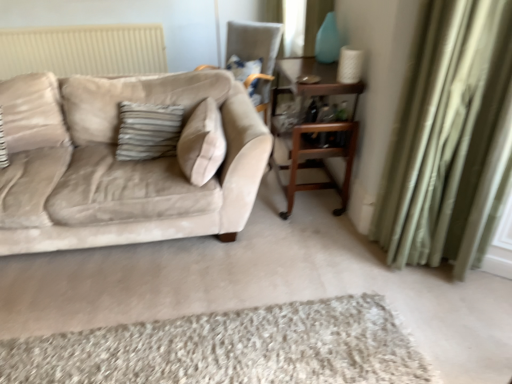
What do you see at coordinates (256, 53) in the screenshot? I see `velvet beige chair at upper center` at bounding box center [256, 53].

What is the approximate width of velvet beige chair at upper center?

The width of velvet beige chair at upper center is 34.68 inches.

In order to click on beige velvet couch at left in this screenshot , I will do `click(125, 162)`.

I want to click on shaggy beige rug at lower center, so click(230, 348).

Measure the distance between velvet beige chair at upper center and shaggy beige rug at lower center.

velvet beige chair at upper center is 8.39 feet from shaggy beige rug at lower center.

From the image's perspective, which one is positioned higher, velvet beige chair at upper center or shaggy beige rug at lower center?

velvet beige chair at upper center appears higher in the image.

In terms of width, does velvet beige chair at upper center look wider or thinner when compared to shaggy beige rug at lower center?

In the image, velvet beige chair at upper center appears to be wider than shaggy beige rug at lower center.

Considering their positions, is velvet beige chair at upper center located in front of or behind shaggy beige rug at lower center?

Clearly, velvet beige chair at upper center is behind shaggy beige rug at lower center.

From the image's perspective, is green velvet curtain at right under wooden table at center?

Yes, from the image's perspective, green velvet curtain at right is beneath wooden table at center.

The height and width of the screenshot is (384, 512). I want to click on table below the green velvet curtain at right (from a real-world perspective), so click(x=313, y=128).

Is point (428, 77) less distant than point (281, 88)?

Yes.

From a real-world perspective, is green velvet curtain at right physically located above or below wooden table at center?

Clearly, from a real-world perspective, green velvet curtain at right is above wooden table at center.

How many degrees apart are the facing directions of green velvet curtain at right and shaggy beige rug at lower center?

144 degrees.

Would you say green velvet curtain at right is outside shaggy beige rug at lower center?

Yes, green velvet curtain at right is located beyond the bounds of shaggy beige rug at lower center.

Which object is closer to the camera taking this photo, green velvet curtain at right or shaggy beige rug at lower center?

Positioned in front is green velvet curtain at right.

From their relative heights in the image, would you say green velvet curtain at right is taller or shorter than velvet beige chair at upper center?

green velvet curtain at right is taller than velvet beige chair at upper center.

Is green velvet curtain at right positioned in front of velvet beige chair at upper center?

Yes, it is in front of velvet beige chair at upper center.

Is velvet beige chair at upper center a part of green velvet curtain at right?

No, velvet beige chair at upper center is not surrounded by green velvet curtain at right.

Can you confirm if green velvet curtain at right is thinner than velvet beige chair at upper center?

Yes.

Considering the positions of point (232, 362) and point (187, 104), is point (232, 362) closer or farther from the camera than point (187, 104)?

Point (232, 362) is positioned closer to the camera compared to point (187, 104).

Locate an element on the screen. plain below the beige velvet couch at left (from a real-world perspective) is located at coordinates (230, 348).

Is the position of shaggy beige rug at lower center more distant than that of beige velvet couch at left?

No, shaggy beige rug at lower center is closer to the camera.

Is the surface of shaggy beige rug at lower center in direct contact with beige velvet couch at left?

shaggy beige rug at lower center and beige velvet couch at left are not in contact.

Is velvet beige chair at upper center facing towards beige velvet couch at left?

Yes.

Is velvet beige chair at upper center at the right side of beige velvet couch at left?

Yes.

From a real-world perspective, is velvet beige chair at upper center below beige velvet couch at left?

No.

How much distance is there between shaggy beige rug at lower center and wooden table at center?

shaggy beige rug at lower center and wooden table at center are 1.14 meters apart from each other.

Based on the photo, is shaggy beige rug at lower center positioned with its back to wooden table at center?

No, shaggy beige rug at lower center's orientation is not away from wooden table at center.

From the image's perspective, would you say shaggy beige rug at lower center is positioned over wooden table at center?

No, from the image's perspective, shaggy beige rug at lower center is not over wooden table at center.

Can you confirm if shaggy beige rug at lower center is wider than wooden table at center?

Yes.

In order to click on plain lying below the velvet beige chair at upper center (from the image's perspective) in this screenshot , I will do `click(230, 348)`.

This screenshot has width=512, height=384. I want to click on curtain that appears above the wooden table at center (from a real-world perspective), so click(452, 140).

When comparing their distances from shaggy beige rug at lower center, does green velvet curtain at right or velvet beige chair at upper center seem further?

velvet beige chair at upper center.

When comparing their distances from shaggy beige rug at lower center, does velvet beige chair at upper center or beige velvet couch at left seem closer?

beige velvet couch at left is closer to shaggy beige rug at lower center.

Estimate the real-world distances between objects in this image. Which object is closer to wooden table at center, beige velvet couch at left or green velvet curtain at right?

green velvet curtain at right is closer to wooden table at center.

Which object lies nearer to the anchor point shaggy beige rug at lower center, green velvet curtain at right or beige velvet couch at left?

green velvet curtain at right is closer to shaggy beige rug at lower center.

Estimate the real-world distances between objects in this image. Which object is closer to wooden table at center, beige velvet couch at left or shaggy beige rug at lower center?

beige velvet couch at left lies closer to wooden table at center than the other object.

Looking at the image, which one is located further to beige velvet couch at left, velvet beige chair at upper center or green velvet curtain at right?

velvet beige chair at upper center.

Looking at the image, which one is located closer to shaggy beige rug at lower center, beige velvet couch at left or velvet beige chair at upper center?

Based on the image, beige velvet couch at left appears to be nearer to shaggy beige rug at lower center.

Estimate the real-world distances between objects in this image. Which object is further from velvet beige chair at upper center, wooden table at center or green velvet curtain at right?

green velvet curtain at right is positioned further to the anchor velvet beige chair at upper center.

Locate an element on the screen. Image resolution: width=512 pixels, height=384 pixels. studio couch between shaggy beige rug at lower center and velvet beige chair at upper center from front to back is located at coordinates (125, 162).

This screenshot has height=384, width=512. I want to click on plain between green velvet curtain at right and velvet beige chair at upper center from front to back, so click(230, 348).

Where is `table between velvet beige chair at upper center and shaggy beige rug at lower center vertically`? The width and height of the screenshot is (512, 384). table between velvet beige chair at upper center and shaggy beige rug at lower center vertically is located at coordinates (313, 128).

Find the location of `table between beige velvet couch at left and green velvet curtain at right in the horizontal direction`. table between beige velvet couch at left and green velvet curtain at right in the horizontal direction is located at coordinates (313, 128).